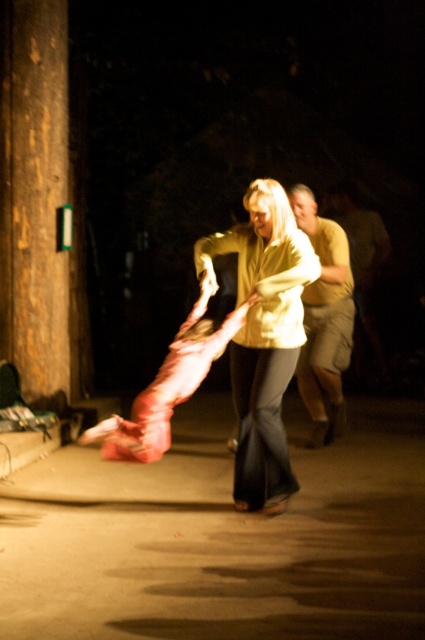
Does matte yellow shirt at center come in front of light brown cotton shorts at right?

Yes, it is in front of light brown cotton shorts at right.

Is matte yellow shirt at center bigger than light brown cotton shorts at right?

Incorrect, matte yellow shirt at center is not larger than light brown cotton shorts at right.

Does point (261, 401) come closer to viewer compared to point (306, 192)?

Yes, it is.

Find the location of a particular element. matte yellow shirt at center is located at coordinates (263, 337).

Between brown concrete pavement at center and matte yellow shirt at center, which one has less height?

brown concrete pavement at center is shorter.

What do you see at coordinates (221, 538) in the screenshot? I see `brown concrete pavement at center` at bounding box center [221, 538].

Does point (190, 570) come closer to viewer compared to point (269, 214)?

That is True.

You are a GUI agent. You are given a task and a screenshot of the screen. Output one action in this format:
    pyautogui.click(x=<x>, y=<y>)
    Task: Click on the brown concrete pavement at center
    Image resolution: width=425 pixels, height=640 pixels.
    Given the screenshot: What is the action you would take?
    pyautogui.click(x=221, y=538)

Describe the element at coordinates (221, 538) in the screenshot. I see `brown concrete pavement at center` at that location.

Between point (105, 545) and point (45, 81), which one is positioned behind?

Positioned behind is point (45, 81).

Where is `brown concrete pavement at center`? The image size is (425, 640). brown concrete pavement at center is located at coordinates pyautogui.click(x=221, y=538).